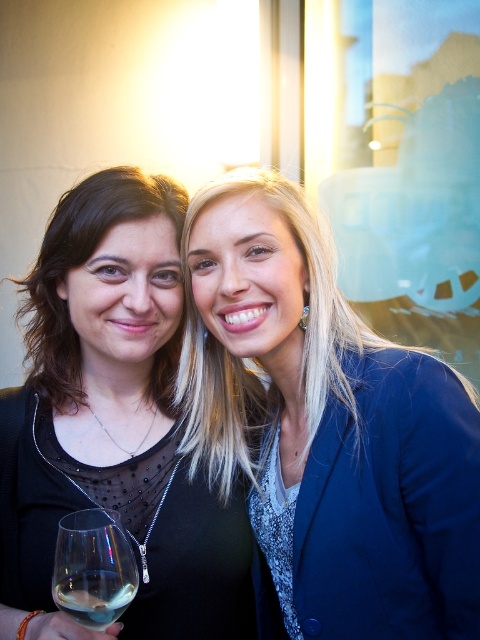
Question: Can you confirm if blue satin blazer at upper right is positioned to the right of clear glass wine glass at lower left?

Choices:
 (A) yes
 (B) no

Answer: (A)

Question: Among these points, which one is nearest to the camera?

Choices:
 (A) (121, 525)
 (B) (24, 408)
 (C) (112, 596)

Answer: (C)

Question: Observing the image, what is the correct spatial positioning of black matte dress at center in reference to clear glass wine glass at lower left?

Choices:
 (A) left
 (B) right

Answer: (A)

Question: Which point is farther to the camera?

Choices:
 (A) black matte dress at center
 (B) clear glass wine glass at lower left
 (C) clear glass wine at lower left

Answer: (A)

Question: Which is nearer to the blue satin blazer at upper right?

Choices:
 (A) clear glass wine glass at lower left
 (B) black matte dress at center

Answer: (B)

Question: Is blue satin blazer at upper right smaller than clear glass wine glass at lower left?

Choices:
 (A) no
 (B) yes

Answer: (A)